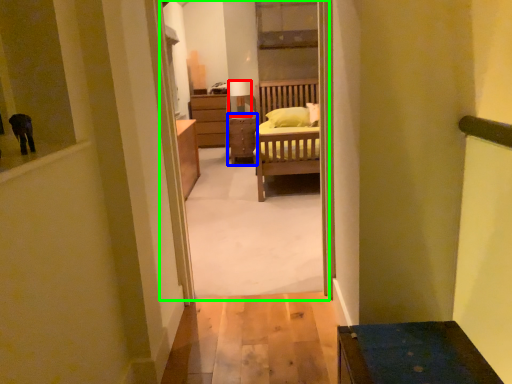
Question: Which object is positioned closest to lamp (highlighted by a red box)? Select from table (highlighted by a blue box) and corridor (highlighted by a green box).

Choices:
 (A) table
 (B) corridor

Answer: (A)